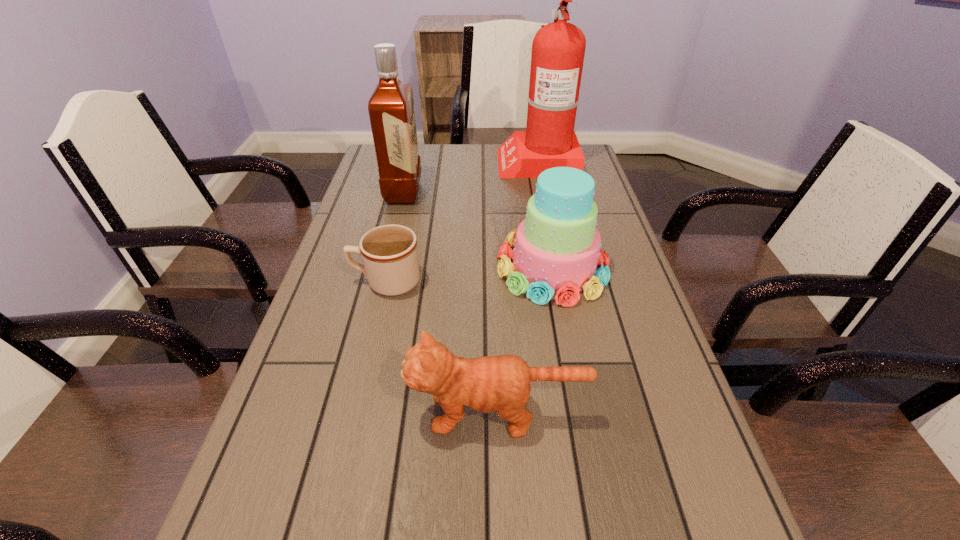
Image resolution: width=960 pixels, height=540 pixels. Identify the location of object that ranks as the fourth closest to the nearest object. (558, 49).

Identify the location of vacant space that satisfies the following two spatial constraints: 1. on the front side of the cake; 2. on the face of the fourth tallest object. The image size is (960, 540). (579, 413).

Image resolution: width=960 pixels, height=540 pixels. What are the coordinates of `blank space that satisfies the following two spatial constraints: 1. on the side of the mug with the handle; 2. on the front label of the fourth shortest object` in the screenshot? It's located at [x=407, y=192].

Locate an element on the screen. The image size is (960, 540). free spot that satisfies the following two spatial constraints: 1. on the side of the mug with the handle; 2. on the front label of the fourth nearest object is located at coordinates (407, 192).

The height and width of the screenshot is (540, 960). Find the location of `vacant position in the image that satisfies the following two spatial constraints: 1. on the front label of the fourth shortest object; 2. on the side of the shortest object with the handle`. vacant position in the image that satisfies the following two spatial constraints: 1. on the front label of the fourth shortest object; 2. on the side of the shortest object with the handle is located at coordinates (381, 281).

Where is `free point that satisfies the following two spatial constraints: 1. on the back side of the cake; 2. on the front label of the second tallest object`? Image resolution: width=960 pixels, height=540 pixels. free point that satisfies the following two spatial constraints: 1. on the back side of the cake; 2. on the front label of the second tallest object is located at coordinates (539, 192).